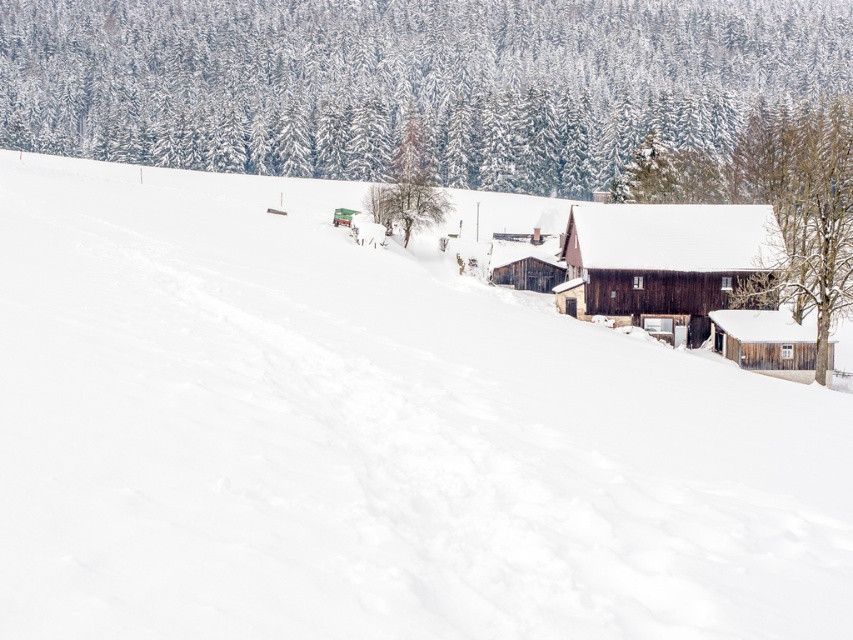
Is snow-covered wooden tree at lower right to the left of green textured tree at upper center from the viewer's perspective?

No, snow-covered wooden tree at lower right is not to the left of green textured tree at upper center.

Based on the photo, which is below, snow-covered wooden tree at lower right or green textured tree at upper center?

Positioned lower is snow-covered wooden tree at lower right.

Which is in front, point (746, 154) or point (628, 168)?

Point (628, 168) is more forward.

The width and height of the screenshot is (853, 640). Find the location of `snow-covered wooden tree at lower right`. snow-covered wooden tree at lower right is located at coordinates (801, 209).

Between bare wood tree at center and wooden cabin at right, which one appears on the right side from the viewer's perspective?

From the viewer's perspective, wooden cabin at right appears more on the right side.

Is point (422, 152) farther from camera compared to point (741, 317)?

Yes, point (422, 152) is farther from viewer.

The width and height of the screenshot is (853, 640). I want to click on bare wood tree at center, so click(409, 184).

Looking at this image, between snow-covered evergreen at upper center and wooden cabin at right, which one is positioned lower?

Positioned lower is wooden cabin at right.

Between point (201, 145) and point (728, 353), which one is positioned behind?

Point (201, 145)

Image resolution: width=853 pixels, height=640 pixels. In order to click on snow-covered evergreen at upper center in this screenshot , I will do `click(408, 81)`.